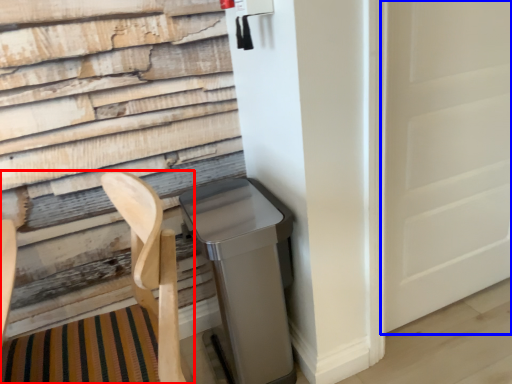
Question: Which object is closer to the camera taking this photo, folding chair (highlighted by a red box) or screen door (highlighted by a blue box)?

Choices:
 (A) folding chair
 (B) screen door

Answer: (A)